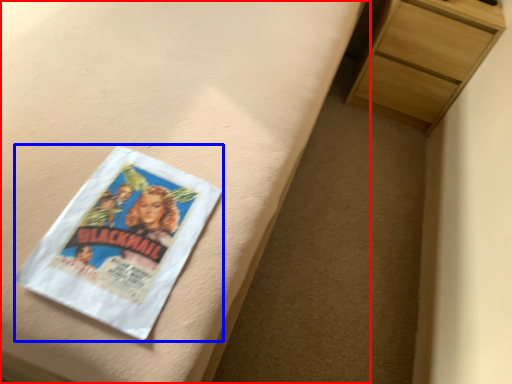
Question: Which object appears closest to the camera in this image, bed frame (highlighted by a red box) or paperback book (highlighted by a blue box)?

Choices:
 (A) bed frame
 (B) paperback book

Answer: (A)